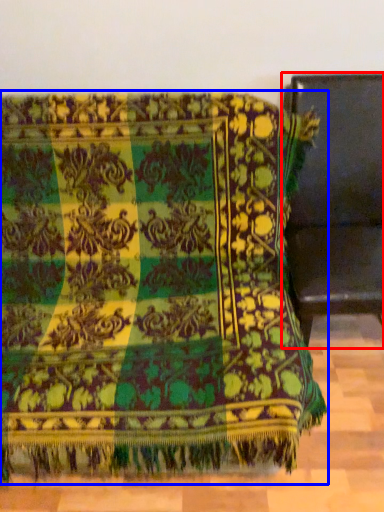
Question: Which point is further to the camera, furniture (highlighted by a red box) or furniture (highlighted by a blue box)?

Choices:
 (A) furniture
 (B) furniture

Answer: (A)